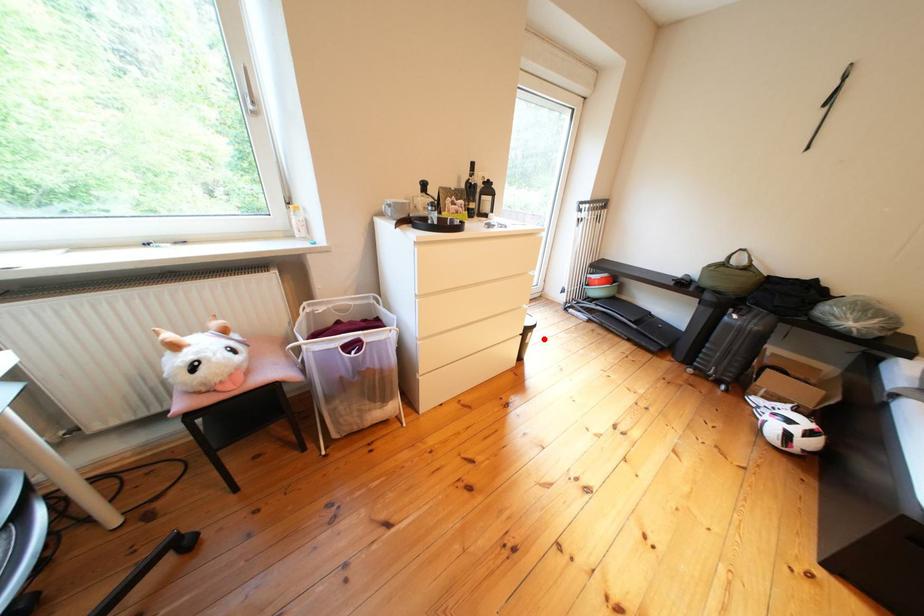
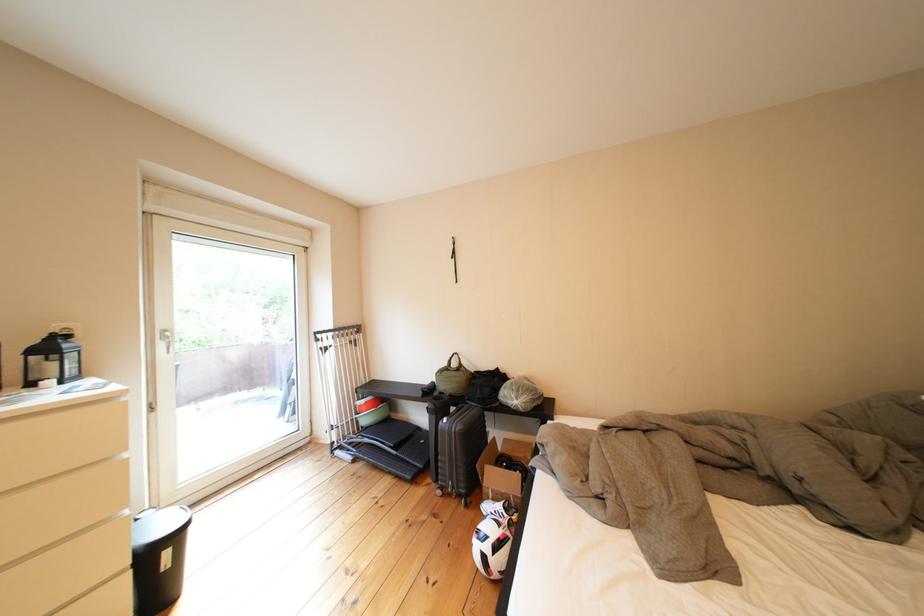
Question: I am providing you with two images of the same scene from different viewpoints. Image1 has a red point marked. In image2, the corresponding 3D location appears at what relative position? Reply with the corresponding letter.

Choices:
 (A) Closer
 (B) Farther

Answer: (A)